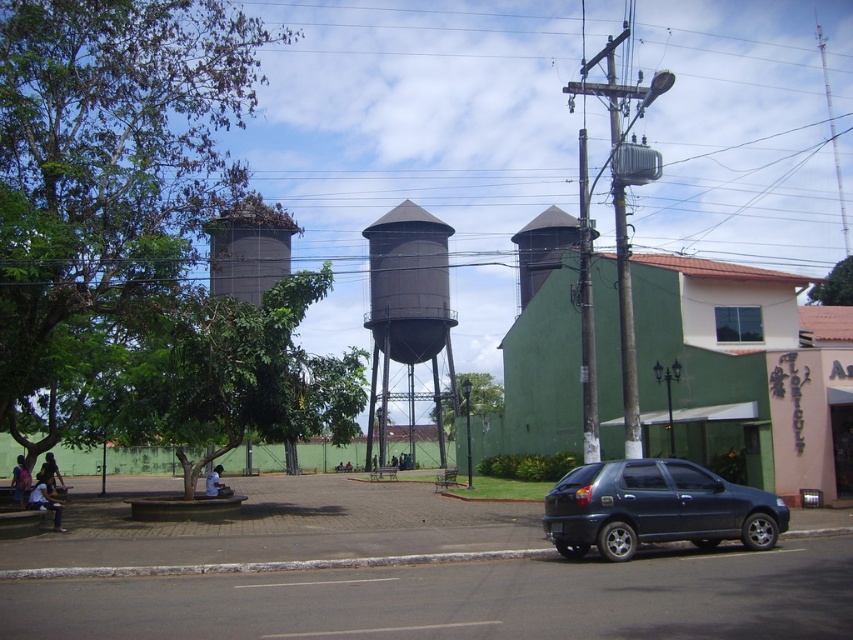
Could you measure the distance between shiny black hatchback at lower right and dark gray metallic water tower at center?

shiny black hatchback at lower right and dark gray metallic water tower at center are 49.85 meters apart.

Consider the image. Can you confirm if shiny black hatchback at lower right is shorter than dark gray metallic water tower at center?

Yes.

Between point (567, 474) and point (381, 412), which one is positioned behind?

The point (381, 412) is more distant.

This screenshot has height=640, width=853. I want to click on shiny black hatchback at lower right, so click(x=654, y=508).